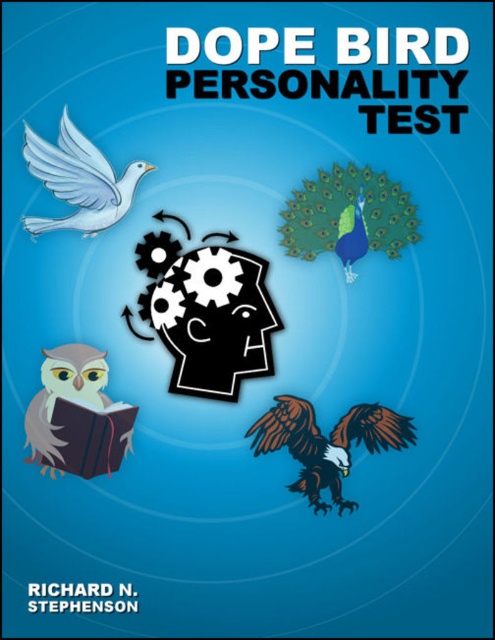
Can you confirm if white matte dove at upper left is bigger than hardcover book at lower left?

Yes.

Does white matte dove at upper left appear on the left side of hardcover book at lower left?

Correct, you'll find white matte dove at upper left to the left of hardcover book at lower left.

Image resolution: width=495 pixels, height=640 pixels. Identify the location of white matte dove at upper left. (79, 180).

At what (x,y) coordinates should I click in order to perform the action: click on white matte dove at upper left. Please return your answer as a coordinate pair (x, y). The height and width of the screenshot is (640, 495). Looking at the image, I should click on (79, 180).